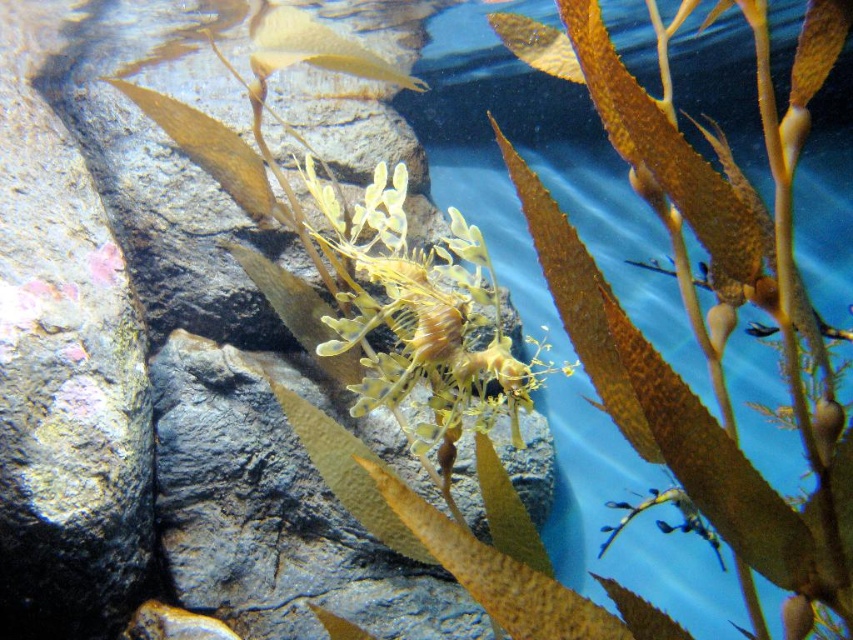
Is point (379, 220) in front of point (693, 529)?

Yes, point (379, 220) is closer to viewer.

Between translucent yellow seahorse at center and translucent yellowish-green seahorse at center, which one is positioned lower?

translucent yellowish-green seahorse at center is lower down.

Where is `translucent yellow seahorse at center`? Image resolution: width=853 pixels, height=640 pixels. translucent yellow seahorse at center is located at coordinates (422, 314).

How distant is translucent yellow leaf at upper center from translucent yellowish-green seahorse at center?

The distance of translucent yellow leaf at upper center from translucent yellowish-green seahorse at center is 38.81 inches.

Between point (329, 58) and point (634, 515), which one is positioned in front?

Positioned in front is point (329, 58).

Is point (328, 45) less distant than point (686, 524)?

Yes.

This screenshot has height=640, width=853. I want to click on translucent yellow leaf at upper center, so click(x=314, y=49).

Which of these two, translucent yellow seahorse at center or translucent yellow leaf at upper center, stands shorter?

translucent yellow leaf at upper center is shorter.

Is point (514, 390) in front of point (364, 51)?

Yes, it is in front of point (364, 51).

Image resolution: width=853 pixels, height=640 pixels. I want to click on translucent yellow seahorse at center, so click(x=422, y=314).